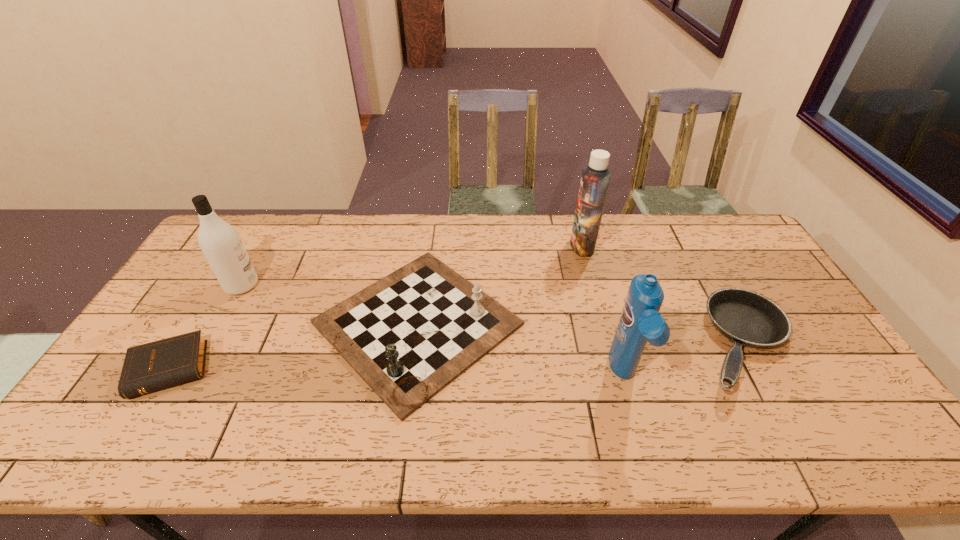
Image resolution: width=960 pixels, height=540 pixels. I want to click on vacant area situated 0.390m on the front label of the farthest shampoo, so click(458, 246).

Identify the location of vacant position located 0.350m on the front-facing side of the leftmost shampoo. (370, 285).

Locate an element on the screen. The image size is (960, 540). vacant region located 0.060m on the front of the nearest shampoo is located at coordinates (640, 431).

Image resolution: width=960 pixels, height=540 pixels. I want to click on vacant space located on the right of the third object from left to right, so click(617, 324).

Where is `free space located on the left of the rightmost object`? This screenshot has height=540, width=960. free space located on the left of the rightmost object is located at coordinates (569, 344).

I want to click on vacant space located on the back of the Bible, so click(x=227, y=281).

Locate an element on the screen. The image size is (960, 540). shampoo that is positioned at the far edge is located at coordinates (595, 178).

Image resolution: width=960 pixels, height=540 pixels. Identify the location of gameboard at the far edge. (409, 335).

Identify the location of object present at the near edge. (409, 335).

In order to click on shampoo present at the left edge in this screenshot , I will do `click(220, 243)`.